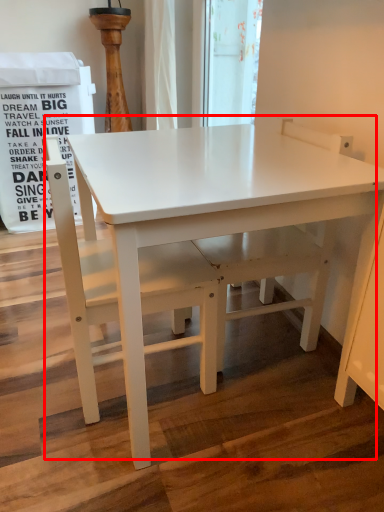
Question: From the image's perspective, where is table (annotated by the red box) located in relation to chair in the image?

Choices:
 (A) above
 (B) below

Answer: (A)